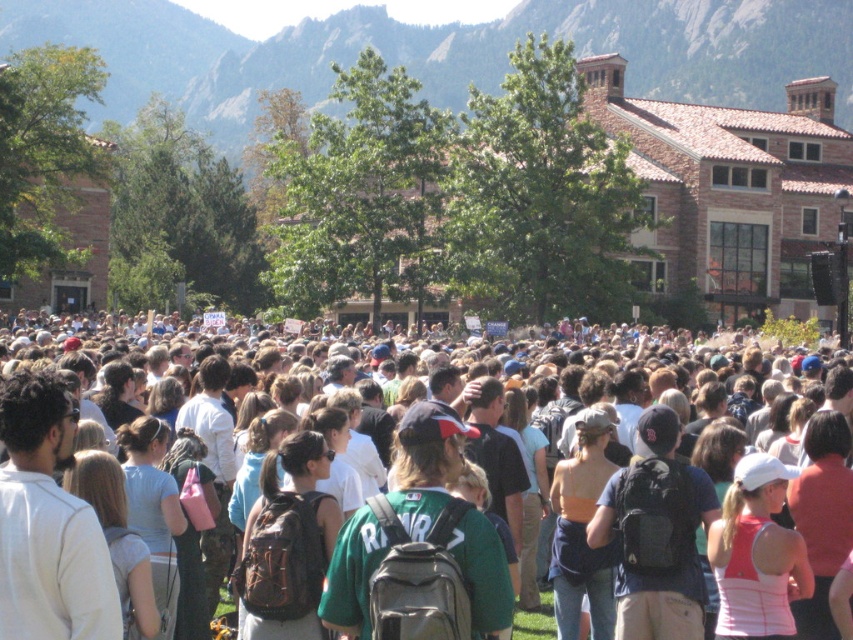
You are a photographer at the event and want to capture a photo that includes both the multicolored casual clothing at center and the rugged stone mountain at upper center. Given that your camera has a maximum focusing distance of 150 meters, will you be able to get both subjects in focus?

The multicolored casual clothing at center is 160.45 meters away from the rugged stone mountain at upper center. Since the camera can only focus up to 150 meters, the distance between them exceeds the camera limit, so both subjects cannot be in focus simultaneously.

From the picture: You are a photographer trying to capture a photo of the rugged stone mountain at upper center without including the crowd. Based on the scene, can you position yourself in a way to exclude the multicolored casual clothing at center from your shot?

The multicolored casual clothing at center is closer to the viewer than rugged stone mountain at upper center, so if you move further back or adjust your angle to frame the mountain while avoiding the foreground crowd, you can exclude the multicolored casual clothing at center from your shot.